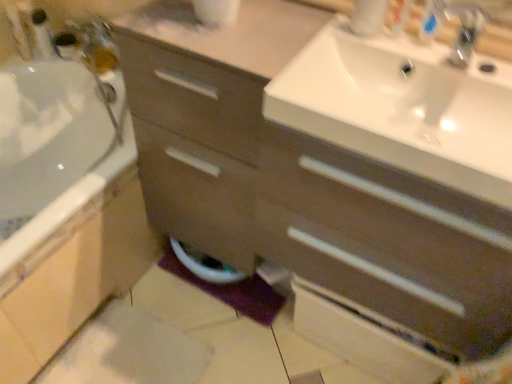
Question: From the image's perspective, would you say purple fabric bath mat at lower center is positioned over white glossy toilet bowl at lower center?

Choices:
 (A) no
 (B) yes

Answer: (A)

Question: Is white glossy toilet bowl at lower center a part of purple fabric bath mat at lower center?

Choices:
 (A) yes
 (B) no

Answer: (B)

Question: Does purple fabric bath mat at lower center lie in front of white glossy toilet bowl at lower center?

Choices:
 (A) yes
 (B) no

Answer: (B)

Question: Is purple fabric bath mat at lower center oriented towards white glossy toilet bowl at lower center?

Choices:
 (A) yes
 (B) no

Answer: (B)

Question: Considering the relative sizes of purple fabric bath mat at lower center and white glossy toilet bowl at lower center in the image provided, is purple fabric bath mat at lower center smaller than white glossy toilet bowl at lower center?

Choices:
 (A) no
 (B) yes

Answer: (B)

Question: From the image's perspective, is white plastic toothbrush at upper right, the second toiletry when ordered from left to right, above or below white glossy sink at upper right?

Choices:
 (A) above
 (B) below

Answer: (A)

Question: Considering the positions of white plastic toothbrush at upper right, arranged as the 1th toiletry when viewed from the right, and white glossy sink at upper right in the image, is white plastic toothbrush at upper right, arranged as the 1th toiletry when viewed from the right, bigger or smaller than white glossy sink at upper right?

Choices:
 (A) big
 (B) small

Answer: (B)

Question: In the image, is white plastic toothbrush at upper right, the second toiletry when ordered from left to right, on the left side or the right side of white glossy sink at upper right?

Choices:
 (A) right
 (B) left

Answer: (A)

Question: Is white plastic toothbrush at upper right, the 1th toiletry positioned from the front, taller or shorter than white glossy sink at upper right?

Choices:
 (A) short
 (B) tall

Answer: (B)

Question: Considering their positions, is white glossy toilet bowl at lower center located in front of or behind metallic silver faucet at upper right?

Choices:
 (A) front
 (B) behind

Answer: (B)

Question: Is point (209, 279) closer or farther from the camera than point (445, 8)?

Choices:
 (A) farther
 (B) closer

Answer: (A)

Question: Considering the positions of white glossy toilet bowl at lower center and metallic silver faucet at upper right in the image, is white glossy toilet bowl at lower center taller or shorter than metallic silver faucet at upper right?

Choices:
 (A) short
 (B) tall

Answer: (B)

Question: Is white glossy toilet bowl at lower center situated inside metallic silver faucet at upper right or outside?

Choices:
 (A) outside
 (B) inside

Answer: (A)

Question: From the image's perspective, relative to metallic silver faucet at upper right, is purple fabric bath mat at lower center above or below?

Choices:
 (A) below
 (B) above

Answer: (A)

Question: Is purple fabric bath mat at lower center spatially inside metallic silver faucet at upper right, or outside of it?

Choices:
 (A) outside
 (B) inside

Answer: (A)